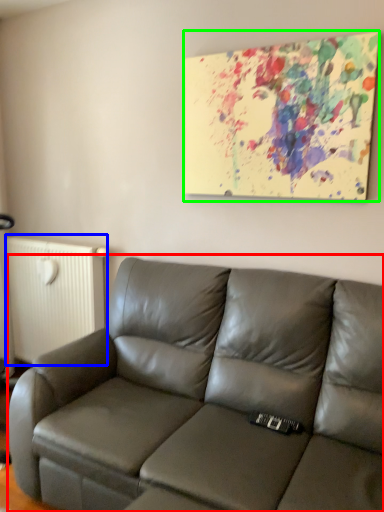
Question: Considering the real-world distances, which object is closest to studio couch (highlighted by a red box)? radiator (highlighted by a blue box) or picture frame (highlighted by a green box).

Choices:
 (A) radiator
 (B) picture frame

Answer: (B)